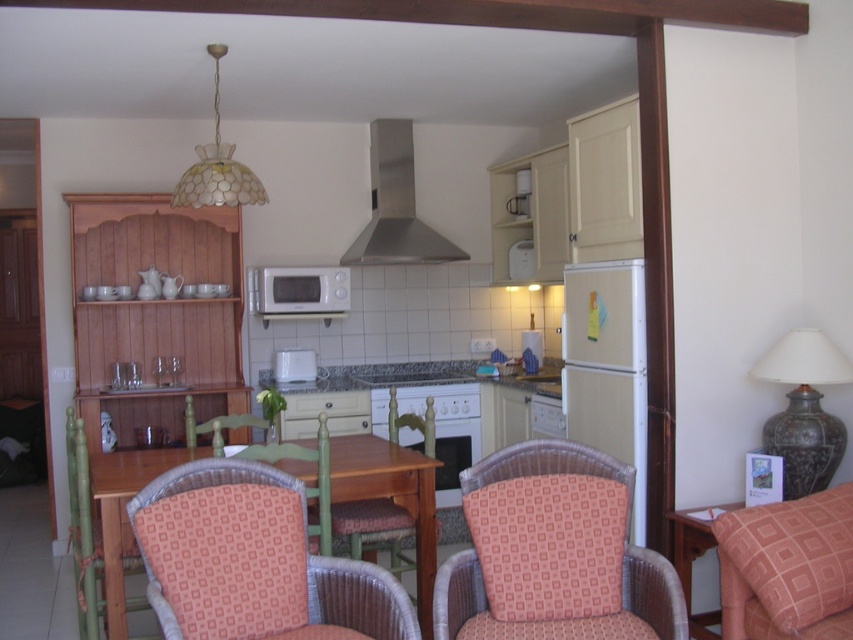
Is point (547, 518) closer to viewer compared to point (379, 545)?

Yes, point (547, 518) is closer to viewer.

Is pink fabric armchair at lower right above woven fabric armchair at center?

Indeed, pink fabric armchair at lower right is positioned over woven fabric armchair at center.

Which is behind, point (463, 566) or point (434, 518)?

The point (434, 518) is more distant.

Identify the location of pink fabric armchair at lower right. This screenshot has height=640, width=853. (555, 548).

Between pink fabric armchair at lower right and white matte microwave at center, which one is positioned higher?

white matte microwave at center

Does pink fabric armchair at lower right lie behind white matte microwave at center?

No, pink fabric armchair at lower right is in front of white matte microwave at center.

Is point (682, 620) positioned behind point (318, 292)?

No.

This screenshot has width=853, height=640. I want to click on pink fabric armchair at lower right, so 555,548.

Where is `pink fabric armchair at lower right`? This screenshot has width=853, height=640. pink fabric armchair at lower right is located at coordinates (555, 548).

Between pink fabric armchair at lower right and wooden table at center, which one has less height?

pink fabric armchair at lower right is shorter.

Locate an element on the screen. pink fabric armchair at lower right is located at coordinates (555, 548).

Locate an element on the screen. pink fabric armchair at lower right is located at coordinates (555, 548).